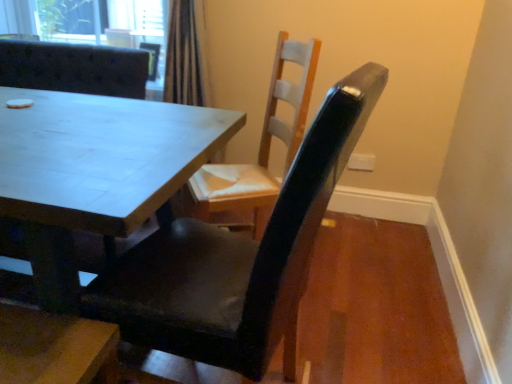
Question: Which direction should I rotate to look at matte black chair at center, which is counted as the second chair, starting from the right?

Choices:
 (A) right
 (B) left

Answer: (B)

Question: Can you confirm if matte black chair at center, which is counted as the second chair, starting from the right, is shorter than matte black chair at center, positioned as the third chair in right-to-left order?

Choices:
 (A) no
 (B) yes

Answer: (A)

Question: Can you confirm if matte black chair at center, which is counted as the second chair, starting from the right, is taller than matte black chair at center, marked as the first chair in a left-to-right arrangement?

Choices:
 (A) yes
 (B) no

Answer: (A)

Question: Does matte black chair at center, which is counted as the second chair, starting from the right, appear on the right side of matte black chair at center, marked as the first chair in a left-to-right arrangement?

Choices:
 (A) no
 (B) yes

Answer: (B)

Question: Does matte black chair at center, which is counted as the second chair, starting from the right, have a lesser width compared to matte black chair at center, marked as the first chair in a left-to-right arrangement?

Choices:
 (A) no
 (B) yes

Answer: (B)

Question: Is matte black chair at center, which is counted as the second chair, starting from the right, aimed at matte black chair at center, positioned as the third chair in right-to-left order?

Choices:
 (A) yes
 (B) no

Answer: (B)

Question: Is matte black chair at center, the 2th chair when ordered from left to right, smaller than matte black chair at center, positioned as the third chair in right-to-left order?

Choices:
 (A) yes
 (B) no

Answer: (A)

Question: Does white wood chair at center, which ranks as the 1th chair in right-to-left order, have a smaller size compared to matte black chair at center, marked as the first chair in a left-to-right arrangement?

Choices:
 (A) no
 (B) yes

Answer: (B)

Question: Considering the relative positions of white wood chair at center, which ranks as the 1th chair in right-to-left order, and matte black chair at center, positioned as the third chair in right-to-left order, in the image provided, is white wood chair at center, which ranks as the 1th chair in right-to-left order, in front of matte black chair at center, positioned as the third chair in right-to-left order,?

Choices:
 (A) no
 (B) yes

Answer: (B)

Question: From a real-world perspective, is white wood chair at center, which ranks as the 1th chair in right-to-left order, positioned under matte black chair at center, positioned as the third chair in right-to-left order, based on gravity?

Choices:
 (A) yes
 (B) no

Answer: (B)

Question: From the image's perspective, is white wood chair at center, which appears as the third chair when viewed from the left, below matte black chair at center, marked as the first chair in a left-to-right arrangement?

Choices:
 (A) no
 (B) yes

Answer: (B)

Question: Is white wood chair at center, which appears as the third chair when viewed from the left, oriented towards matte black chair at center, marked as the first chair in a left-to-right arrangement?

Choices:
 (A) no
 (B) yes

Answer: (A)

Question: From the image's perspective, is white wood chair at center, which ranks as the 1th chair in right-to-left order, on top of matte black chair at center, marked as the first chair in a left-to-right arrangement?

Choices:
 (A) no
 (B) yes

Answer: (A)

Question: Is the depth of white wood chair at center, which ranks as the 1th chair in right-to-left order, greater than that of matte black chair at center, the 2th chair when ordered from left to right?

Choices:
 (A) no
 (B) yes

Answer: (B)